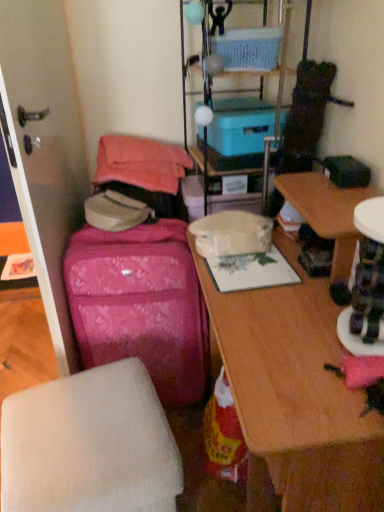
Question: Is blue cardboard box at upper center, arranged as the second storage box when ordered from the bottom, closer to camera compared to wooden desk at center?

Choices:
 (A) yes
 (B) no

Answer: (B)

Question: From a real-world perspective, is blue cardboard box at upper center, arranged as the second storage box when ordered from the bottom, located beneath wooden desk at center?

Choices:
 (A) no
 (B) yes

Answer: (A)

Question: Considering the relative sizes of blue cardboard box at upper center, marked as the 1th storage box in a top-to-bottom arrangement, and wooden desk at center in the image provided, is blue cardboard box at upper center, marked as the 1th storage box in a top-to-bottom arrangement, wider than wooden desk at center?

Choices:
 (A) yes
 (B) no

Answer: (B)

Question: Can you confirm if blue cardboard box at upper center, marked as the 1th storage box in a top-to-bottom arrangement, is smaller than wooden desk at center?

Choices:
 (A) no
 (B) yes

Answer: (B)

Question: Is blue cardboard box at upper center, arranged as the second storage box when ordered from the bottom, completely or partially outside of wooden desk at center?

Choices:
 (A) yes
 (B) no

Answer: (A)

Question: From the image's perspective, would you say blue cardboard box at upper center, marked as the 1th storage box in a top-to-bottom arrangement, is positioned over wooden desk at center?

Choices:
 (A) no
 (B) yes

Answer: (B)

Question: From a real-world perspective, is white matte ottoman at lower left on blue plastic storage at upper center?

Choices:
 (A) no
 (B) yes

Answer: (A)

Question: Can you see white matte ottoman at lower left touching blue plastic storage at upper center?

Choices:
 (A) no
 (B) yes

Answer: (A)

Question: From a real-world perspective, is white matte ottoman at lower left beneath blue plastic storage at upper center?

Choices:
 (A) no
 (B) yes

Answer: (B)

Question: Is white matte ottoman at lower left oriented towards blue plastic storage at upper center?

Choices:
 (A) no
 (B) yes

Answer: (A)

Question: Is white matte ottoman at lower left taller than blue plastic storage at upper center?

Choices:
 (A) yes
 (B) no

Answer: (B)

Question: Can we say white matte ottoman at lower left lies outside blue plastic storage at upper center?

Choices:
 (A) no
 (B) yes

Answer: (B)

Question: Is pink fabric suitcase at left not close to blue cardboard box at upper center, marked as the 1th storage box in a top-to-bottom arrangement?

Choices:
 (A) yes
 (B) no

Answer: (B)